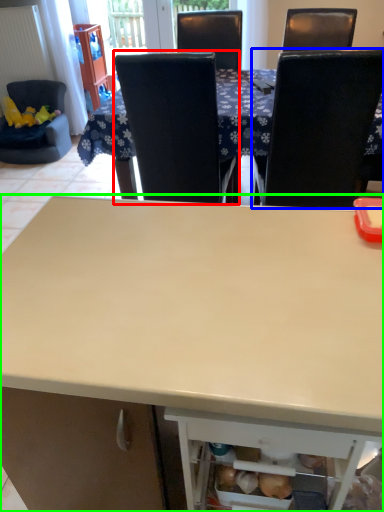
Question: Which object is positioned farthest from chair (highlighted by a red box)? Select from chair (highlighted by a blue box) and desk (highlighted by a green box).

Choices:
 (A) chair
 (B) desk

Answer: (B)